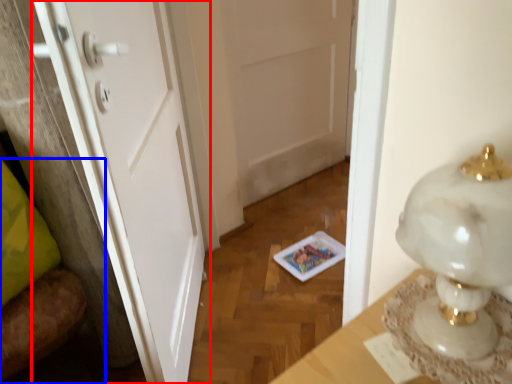
Question: Which object is closer to the camera taking this photo, door (highlighted by a red box) or furniture (highlighted by a blue box)?

Choices:
 (A) door
 (B) furniture

Answer: (A)